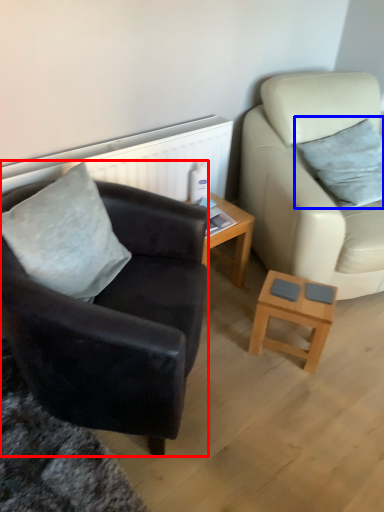
Question: Among these objects, which one is nearest to the camera, chair (highlighted by a red box) or pillow (highlighted by a blue box)?

Choices:
 (A) chair
 (B) pillow

Answer: (A)